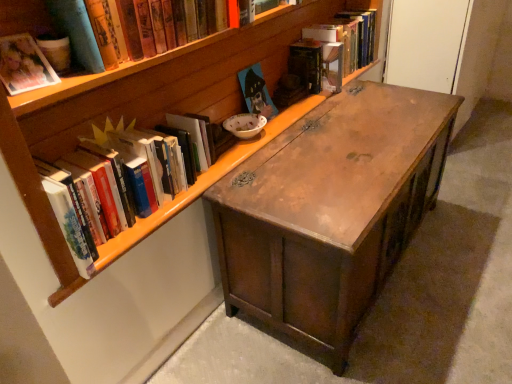
You are a GUI agent. You are given a task and a screenshot of the screen. Output one action in this format:
    pyautogui.click(x=<x>, y=<y>)
    Task: Click on the vacant space situated above hardcover book at upper right, which ranks as the first book in back-to-front order (from a real-world perspective)
    The image size is (512, 384).
    Given the screenshot: What is the action you would take?
    pyautogui.click(x=344, y=13)